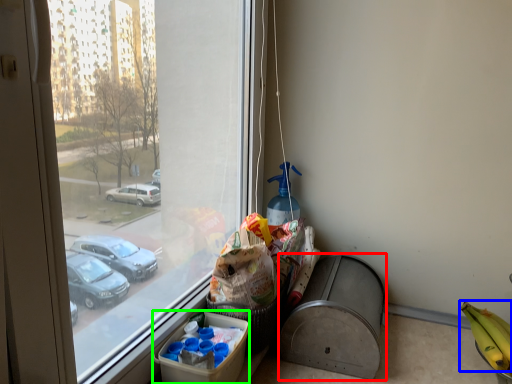
Question: Which object is positioned closest to recycling bin (highlighted by a red box)? Select from banana (highlighted by a blue box) and cardboard box (highlighted by a green box).

Choices:
 (A) banana
 (B) cardboard box

Answer: (B)